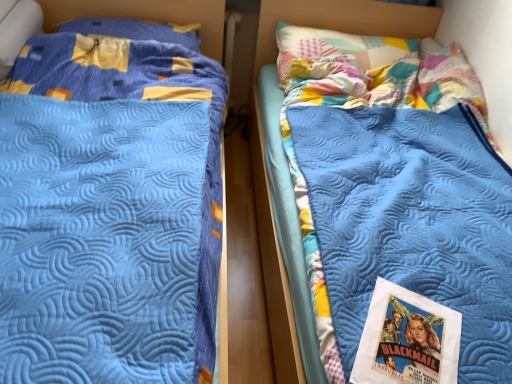
Question: Is blue quilted pillow at upper left wider or thinner than blue quilted mattress at center?

Choices:
 (A) thin
 (B) wide

Answer: (A)

Question: From the image's perspective, is blue quilted pillow at upper left located above or below blue quilted mattress at center?

Choices:
 (A) above
 (B) below

Answer: (A)

Question: Which is nearer to the blue quilted bed at left?

Choices:
 (A) blue quilted pillow at upper left
 (B) blue quilted mattress at center
 (C) matte paper poster at lower right

Answer: (A)

Question: Which object is the closest to the blue quilted bed at left?

Choices:
 (A) matte paper poster at lower right
 (B) blue quilted mattress at center
 (C) blue quilted pillow at upper left

Answer: (C)